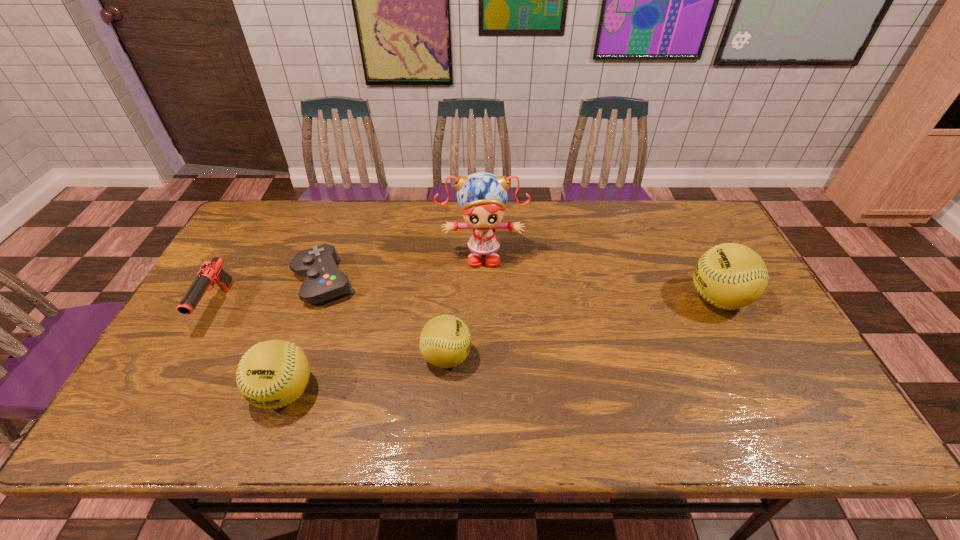
Find the location of `empty space between the second tallest softball and the shortest object`. empty space between the second tallest softball and the shortest object is located at coordinates (304, 337).

Find the location of a particular element. The height and width of the screenshot is (540, 960). vacant point located between the doll and the farthest softball is located at coordinates (600, 276).

Where is `free spot between the rightmost object and the tallest object`? The height and width of the screenshot is (540, 960). free spot between the rightmost object and the tallest object is located at coordinates (600, 276).

Locate which object is the second closest to the leftmost object. Please provide its 2D coordinates. Your answer should be formatted as a tuple, i.e. [(x, y)], where the tuple contains the x and y coordinates of a point satisfying the conditions above.

[(272, 374)]

You are a GUI agent. You are given a task and a screenshot of the screen. Output one action in this format:
    pyautogui.click(x=<x>, y=<y>)
    Task: Click on the fifth closest object to the tallest object
    
    Given the screenshot: What is the action you would take?
    pyautogui.click(x=211, y=272)

Locate which softball is the third closest to the doll. Please provide its 2D coordinates. Your answer should be formatted as a tuple, i.e. [(x, y)], where the tuple contains the x and y coordinates of a point satisfying the conditions above.

[(730, 276)]

Select which softball is the second closest to the doll. Please provide its 2D coordinates. Your answer should be formatted as a tuple, i.e. [(x, y)], where the tuple contains the x and y coordinates of a point satisfying the conditions above.

[(272, 374)]

The image size is (960, 540). Find the location of `free space that satisfies the following two spatial constraints: 1. on the logo side of the rightmost softball; 2. at the aiming end of the leftmost object`. free space that satisfies the following two spatial constraints: 1. on the logo side of the rightmost softball; 2. at the aiming end of the leftmost object is located at coordinates (722, 307).